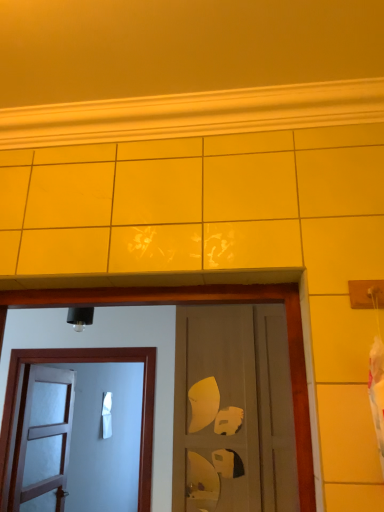
Question: Does white wooden door at left, placed as the third door when sorted from right to left, appear on the left side of matte brown door at center, placed as the 3th door when sorted from left to right?

Choices:
 (A) no
 (B) yes

Answer: (B)

Question: Is there a large distance between white wooden door at left, placed as the third door when sorted from right to left, and matte brown door at center, acting as the 1th door starting from the right?

Choices:
 (A) no
 (B) yes

Answer: (B)

Question: Is white wooden door at left, placed as the third door when sorted from right to left, touching matte brown door at center, placed as the 3th door when sorted from left to right?

Choices:
 (A) no
 (B) yes

Answer: (A)

Question: Is white wooden door at left, arranged as the first door when viewed from the left, thinner than matte brown door at center, placed as the 3th door when sorted from left to right?

Choices:
 (A) no
 (B) yes

Answer: (B)

Question: Can you confirm if white wooden door at left, arranged as the first door when viewed from the left, is positioned to the right of matte brown door at center, placed as the 3th door when sorted from left to right?

Choices:
 (A) yes
 (B) no

Answer: (B)

Question: In terms of width, does matte brown door at center, placed as the 3th door when sorted from left to right, look wider or thinner when compared to white matte door at left, which appears as the second door when viewed from the right?

Choices:
 (A) wide
 (B) thin

Answer: (A)

Question: Relative to white matte door at left, which appears as the second door when viewed from the right, is matte brown door at center, acting as the 1th door starting from the right, in front or behind?

Choices:
 (A) behind
 (B) front

Answer: (B)

Question: Does point (201, 373) appear closer or farther from the camera than point (165, 357)?

Choices:
 (A) closer
 (B) farther

Answer: (A)

Question: From the image's perspective, is matte brown door at center, acting as the 1th door starting from the right, located above or below white matte door at left, which appears as the second door when viewed from the right?

Choices:
 (A) above
 (B) below

Answer: (A)

Question: Considering the positions of matte brown door at center, placed as the 3th door when sorted from left to right, and white wooden door at left, placed as the third door when sorted from right to left, in the image, is matte brown door at center, placed as the 3th door when sorted from left to right, bigger or smaller than white wooden door at left, placed as the third door when sorted from right to left,?

Choices:
 (A) big
 (B) small

Answer: (A)

Question: From the image's perspective, is matte brown door at center, placed as the 3th door when sorted from left to right, above or below white wooden door at left, arranged as the first door when viewed from the left?

Choices:
 (A) above
 (B) below

Answer: (A)

Question: From a real-world perspective, is matte brown door at center, acting as the 1th door starting from the right, above or below white wooden door at left, arranged as the first door when viewed from the left?

Choices:
 (A) below
 (B) above

Answer: (B)

Question: Looking at their shapes, would you say matte brown door at center, placed as the 3th door when sorted from left to right, is wider or thinner than white wooden door at left, arranged as the first door when viewed from the left?

Choices:
 (A) thin
 (B) wide

Answer: (B)

Question: Is point pos(31,394) positioned closer to the camera than point pos(160,421)?

Choices:
 (A) closer
 (B) farther

Answer: (B)

Question: In terms of size, does white wooden door at left, arranged as the first door when viewed from the left, appear bigger or smaller than white matte door at left, which appears as the second door when viewed from the right?

Choices:
 (A) small
 (B) big

Answer: (B)